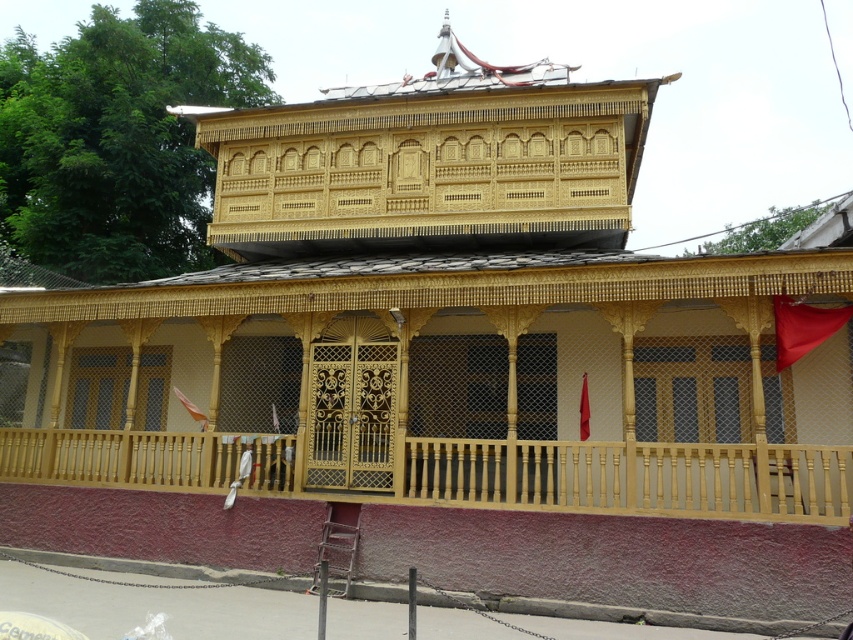
Question: Is matte gold balcony at center wider than smooth wood balcony at center?

Choices:
 (A) no
 (B) yes

Answer: (B)

Question: Does matte gold balcony at center have a larger size compared to smooth wood balcony at center?

Choices:
 (A) yes
 (B) no

Answer: (A)

Question: Which object appears closest to the camera in this image?

Choices:
 (A) matte gold balcony at center
 (B) smooth wood balcony at center

Answer: (A)

Question: Can you confirm if matte gold balcony at center is bigger than smooth wood balcony at center?

Choices:
 (A) yes
 (B) no

Answer: (A)